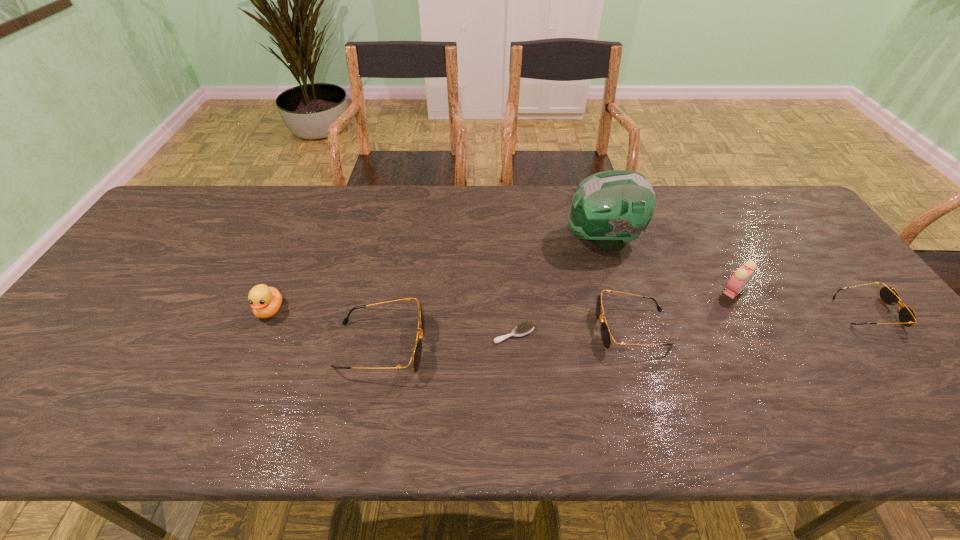
You are a GUI agent. You are given a task and a screenshot of the screen. Output one action in this format:
    pyautogui.click(x=<x>, y=<y>)
    Task: Click on the object that stands as the fourth closest to the duckling
    
    Given the screenshot: What is the action you would take?
    pyautogui.click(x=606, y=336)

Where is `object that is the fourth closest one to the shortest object`? The height and width of the screenshot is (540, 960). object that is the fourth closest one to the shortest object is located at coordinates (741, 277).

Select which sunglasses is the closest to the fifth object from right to left. Please provide its 2D coordinates. Your answer should be formatted as a tuple, i.e. [(x, y)], where the tuple contains the x and y coordinates of a point satisfying the conditions above.

[(606, 336)]

At what (x,y) coordinates should I click in order to perform the action: click on sunglasses that stands as the second closest to the rightmost object. Please return your answer as a coordinate pair (x, y). This screenshot has width=960, height=540. Looking at the image, I should click on (416, 355).

Locate an element on the screen. The width and height of the screenshot is (960, 540). free point that satisfies the following two spatial constraints: 1. on the lenses of the sixth tallest object; 2. on the front side of the shortest object is located at coordinates (884, 334).

Identify the location of vacant point that satisfies the following two spatial constraints: 1. on the visor of the football helmet; 2. on the face of the leftmost object. The image size is (960, 540). (623, 310).